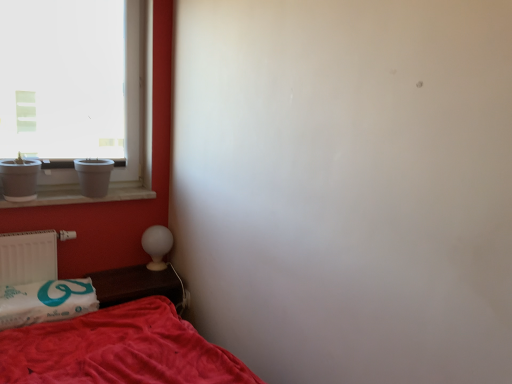
Question: From a real-world perspective, is white marble window sill at left beneath white glossy table lamp at lower left?

Choices:
 (A) no
 (B) yes

Answer: (A)

Question: Can you confirm if white marble window sill at left is wider than white glossy table lamp at lower left?

Choices:
 (A) yes
 (B) no

Answer: (A)

Question: From the image's perspective, is white marble window sill at left located above white glossy table lamp at lower left?

Choices:
 (A) no
 (B) yes

Answer: (B)

Question: Is white marble window sill at left facing away from white glossy table lamp at lower left?

Choices:
 (A) yes
 (B) no

Answer: (B)

Question: Considering the relative positions of white marble window sill at left and white glossy table lamp at lower left in the image provided, is white marble window sill at left to the left of white glossy table lamp at lower left from the viewer's perspective?

Choices:
 (A) no
 (B) yes

Answer: (B)

Question: Is white marble window sill at left outside of white glossy table lamp at lower left?

Choices:
 (A) no
 (B) yes

Answer: (B)

Question: From a real-world perspective, is white matte radiator at lower left over white soft pillow at lower left?

Choices:
 (A) yes
 (B) no

Answer: (A)

Question: Is white matte radiator at lower left taller than white soft pillow at lower left?

Choices:
 (A) no
 (B) yes

Answer: (B)

Question: Is white matte radiator at lower left shorter than white soft pillow at lower left?

Choices:
 (A) yes
 (B) no

Answer: (B)

Question: From the image's perspective, is white matte radiator at lower left over white soft pillow at lower left?

Choices:
 (A) no
 (B) yes

Answer: (B)

Question: Considering the relative sizes of white matte radiator at lower left and white soft pillow at lower left in the image provided, is white matte radiator at lower left thinner than white soft pillow at lower left?

Choices:
 (A) yes
 (B) no

Answer: (A)

Question: Is white matte radiator at lower left next to white soft pillow at lower left and touching it?

Choices:
 (A) yes
 (B) no

Answer: (B)

Question: Is white glossy table lamp at lower left oriented away from white matte radiator at lower left?

Choices:
 (A) no
 (B) yes

Answer: (A)